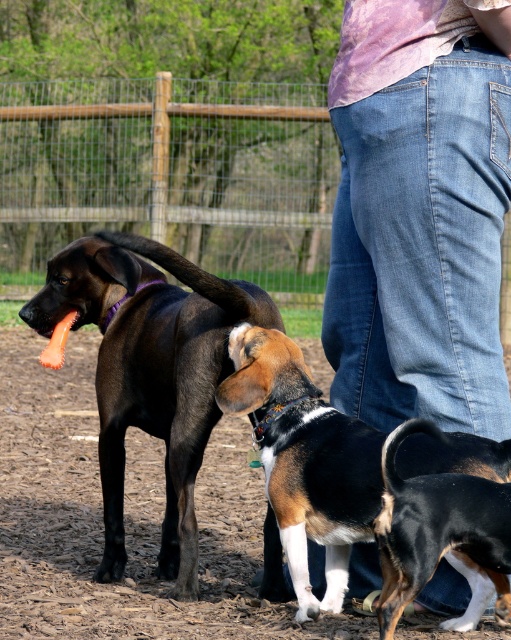
You are standing at the camera position and want to pet the shiny black dog at center. The dog is 4.20 meters away. If you can walk 1 meter per second, how many seconds will it take you to reach the dog?

The shiny black dog at center is 4.20 meters away. Walking at 1 meter per second, it will take 4.20 seconds to reach the dog.

You are standing in the dog park and see the denim jeans at lower right and the wooden fence at upper center. Which one is wider?

The wooden fence at upper center is wider than the denim jeans at lower right.